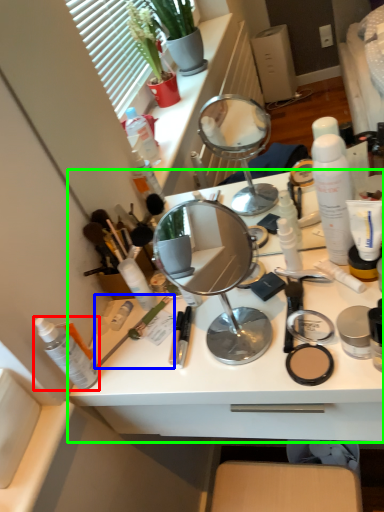
Question: Which object is positioned closest to toiletry (highlighted by a red box)? Select from brush (highlighted by a blue box) and desk (highlighted by a green box).

Choices:
 (A) brush
 (B) desk

Answer: (A)